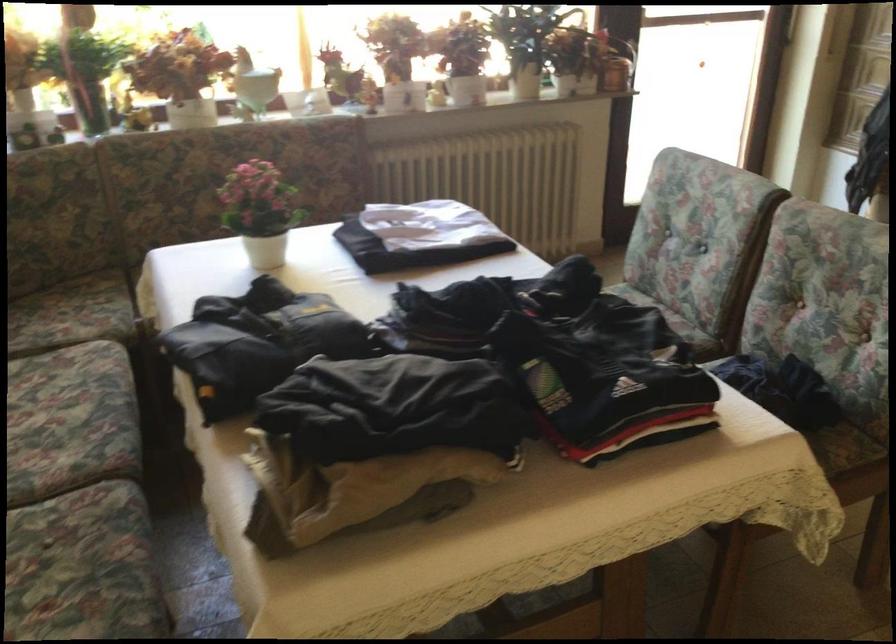
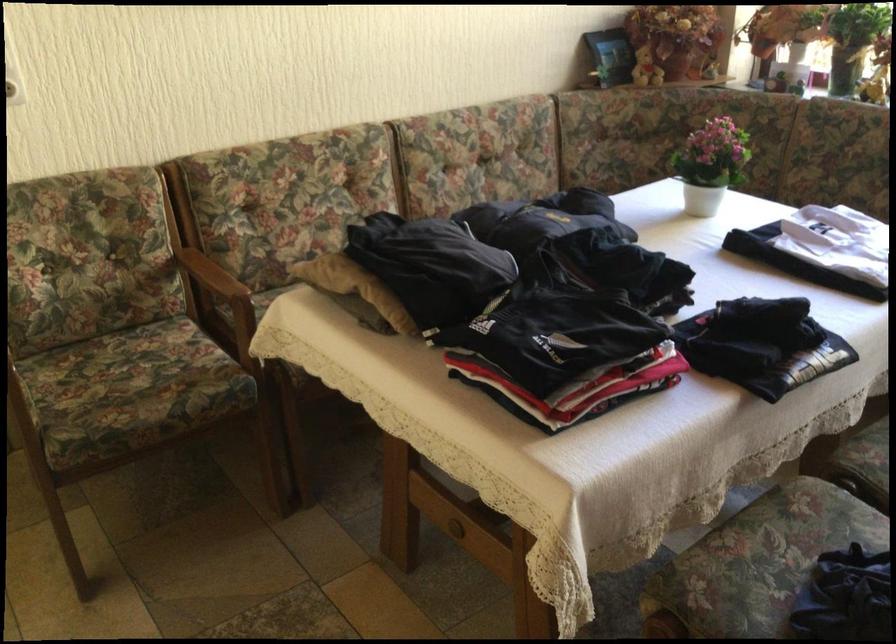
Question: I am providing you with two images of the same scene from different viewpoints. Which of the following objects are not visible in image2?

Choices:
 (A) small brown bottle
 (B) white electrical outlet
 (C) white flower pot
 (D) chair sitting surface

Answer: (D)